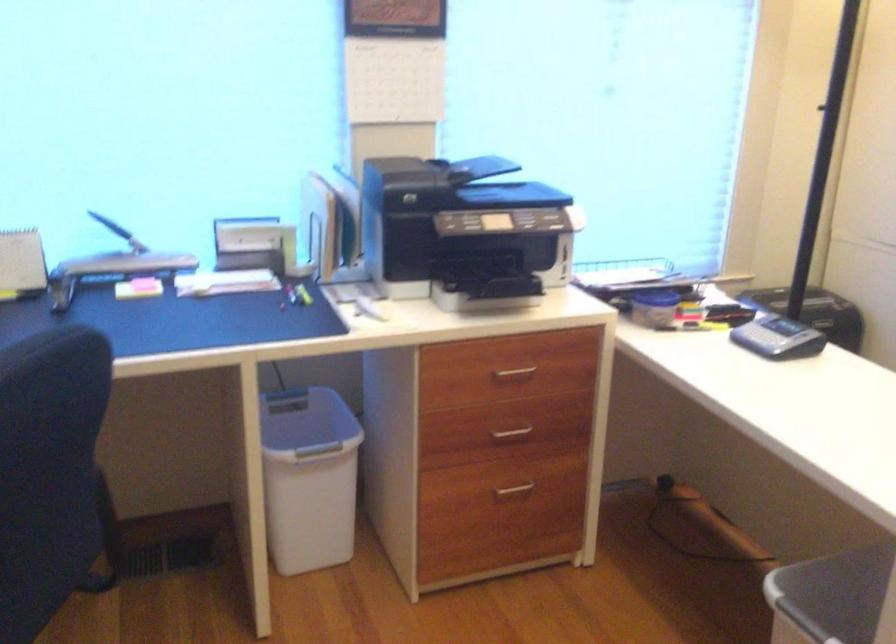
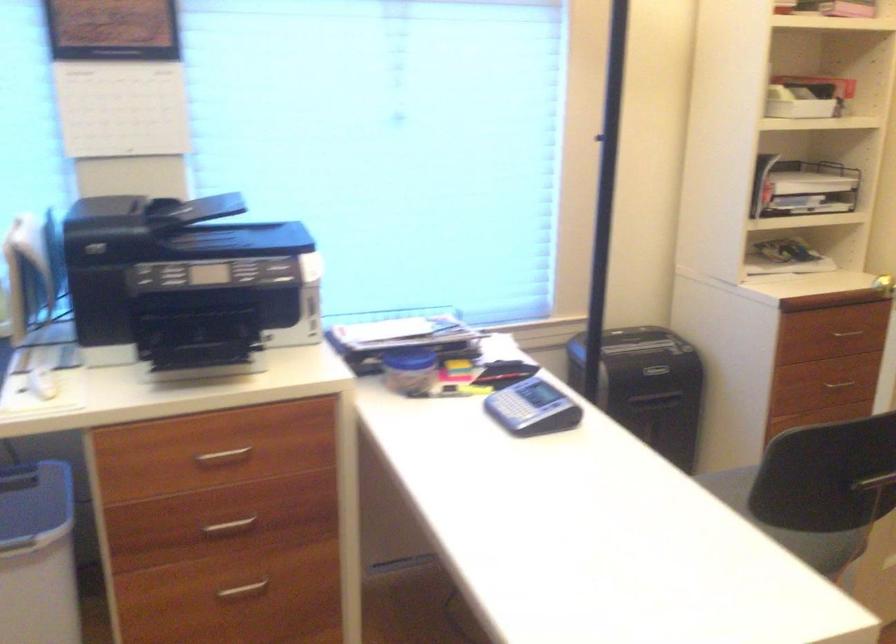
In the second image, find the point that corresponds to [309,430] in the first image.

(35, 513)